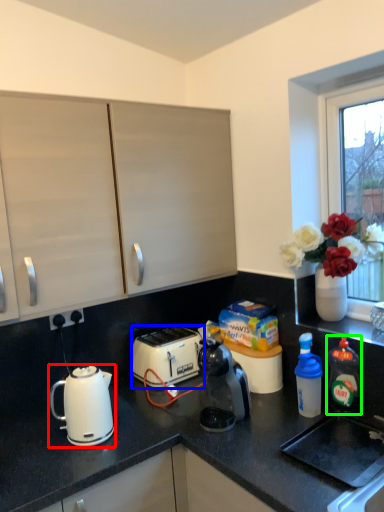
Question: Which is nearer to the kettle (highlighted by a red box)? toaster (highlighted by a blue box) or bottle (highlighted by a green box).

Choices:
 (A) toaster
 (B) bottle

Answer: (A)